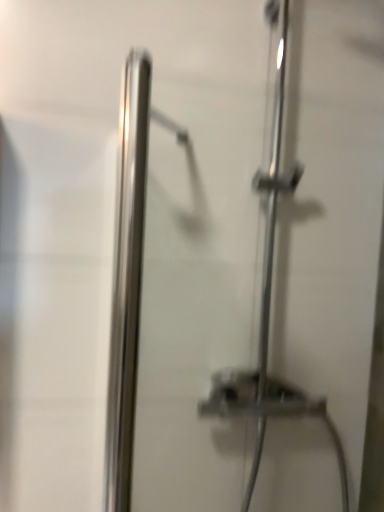
This screenshot has height=512, width=384. What are the coordinates of `satin nickel shower door at center` in the screenshot? It's located at (196, 304).

The image size is (384, 512). Describe the element at coordinates (196, 304) in the screenshot. I see `satin nickel shower door at center` at that location.

What is the approximate width of satin nickel shower door at center?

satin nickel shower door at center is 1.42 inches wide.

Find the location of `satin nickel shower door at center`. satin nickel shower door at center is located at coordinates (196, 304).